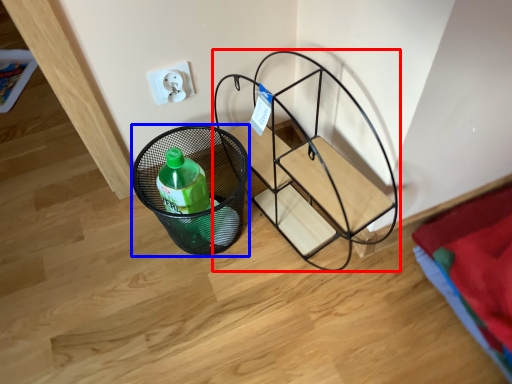
Question: Which point is closer to the camera, furniture (highlighted by a red box) or basket (highlighted by a blue box)?

Choices:
 (A) furniture
 (B) basket

Answer: (A)